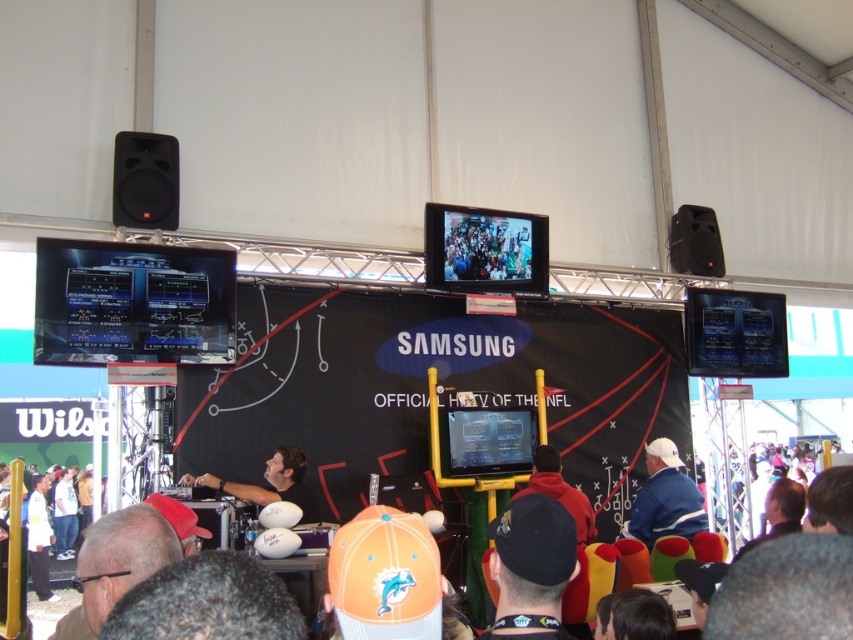
Question: Does dark gray hair at lower left appear over black matte speaker at upper left?

Choices:
 (A) yes
 (B) no

Answer: (B)

Question: Can you confirm if black matte speaker at upper left is smaller than black matte speaker at upper right?

Choices:
 (A) yes
 (B) no

Answer: (A)

Question: Which point appears farthest from the camera in this image?

Choices:
 (A) (171, 147)
 (B) (651, 547)
 (C) (283, 451)
 (D) (699, 244)

Answer: (D)

Question: Is black fabric cap at center to the left of dark gray hair at lower left from the viewer's perspective?

Choices:
 (A) no
 (B) yes

Answer: (A)

Question: Which point is farther to the camera?

Choices:
 (A) (556, 476)
 (B) (548, 604)

Answer: (A)

Question: Among these objects, which one is nearest to the camera?

Choices:
 (A) black fabric cap at center
 (B) blue fabric jacket at lower right
 (C) red fleece jacket at center

Answer: (A)